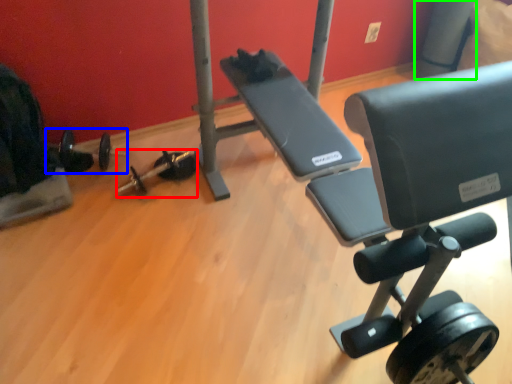
Question: Which is nearer to the dumbbell (highlighted by a red box)? barbell (highlighted by a blue box) or pole (highlighted by a green box).

Choices:
 (A) barbell
 (B) pole

Answer: (A)